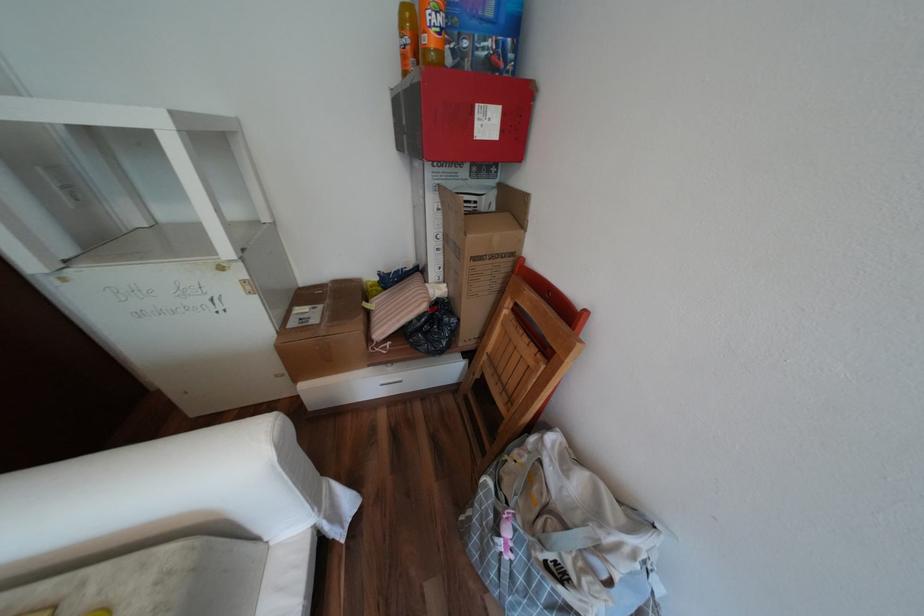
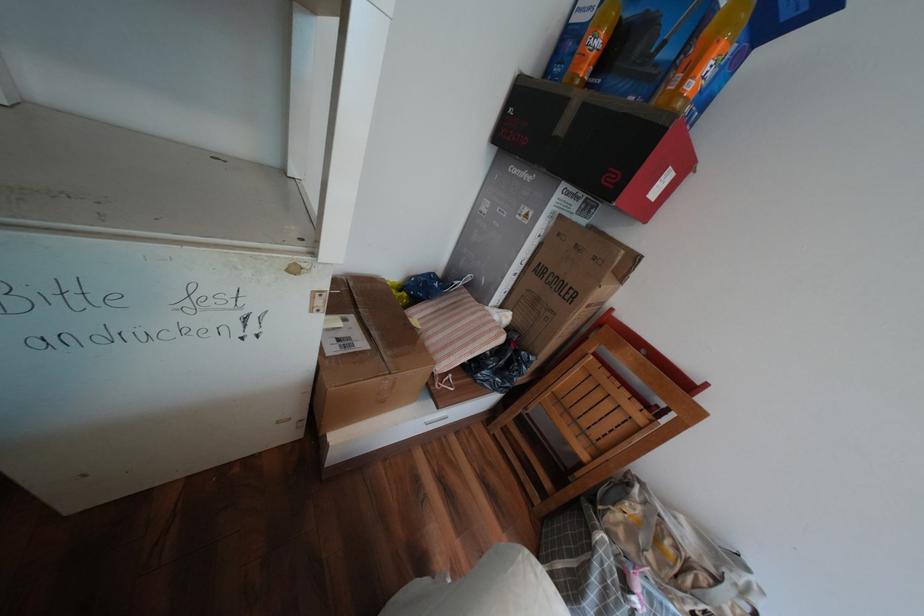
What movement of the cameraman would produce the second image?

The cameraman walked toward left, forward.